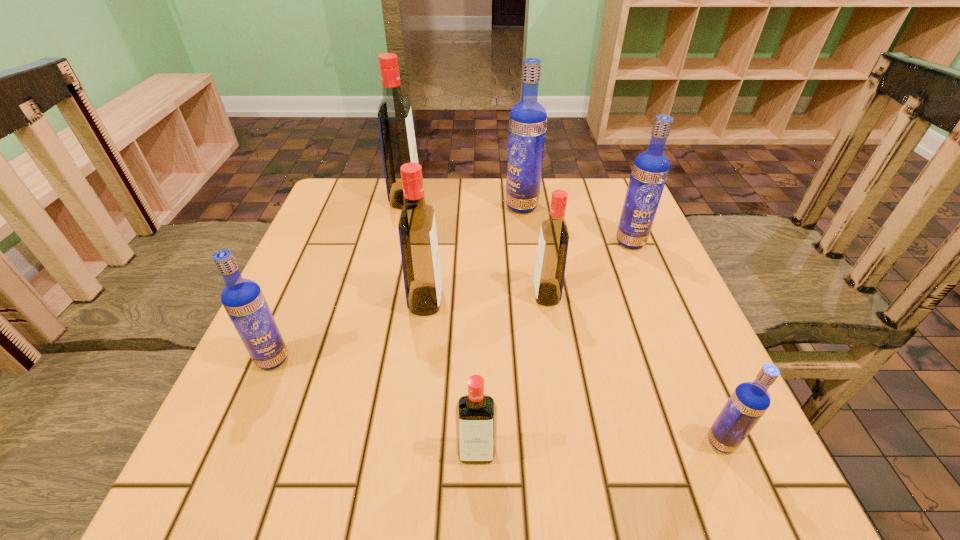
Locate an element on the screen. This screenshot has width=960, height=540. blank space at the far left corner of the desktop is located at coordinates (324, 220).

Where is `vacant area at the near left corner`? vacant area at the near left corner is located at coordinates (221, 489).

Where is `vacant space at the far right corner of the desktop`? This screenshot has width=960, height=540. vacant space at the far right corner of the desktop is located at coordinates (582, 218).

Locate an element on the screen. Image resolution: width=960 pixels, height=540 pixels. blank region between the sixth object from right to left and the smallest red vodka is located at coordinates (451, 377).

This screenshot has height=540, width=960. I want to click on free space that is in between the rightmost red vodka and the smallest red vodka, so click(x=512, y=374).

The image size is (960, 540). In order to click on blank region between the smallest red vodka and the smallest blue vodka in this screenshot , I will do `click(599, 447)`.

Image resolution: width=960 pixels, height=540 pixels. Identify the location of empty location between the nearest red vodka and the third smallest blue vodka. (554, 347).

You are a GUI agent. You are given a task and a screenshot of the screen. Output one action in this format:
    pyautogui.click(x=<x>, y=<y>)
    Task: Click on the vacant space that is in between the second nearest blue vodka and the second red vodka from left to right
    
    Given the screenshot: What is the action you would take?
    pyautogui.click(x=349, y=330)

Identify the location of vacant region between the biggest blue vodka and the rightmost red vodka. 534,251.

I want to click on free area in between the nearest blue vodka and the leftmost blue vodka, so click(x=497, y=401).